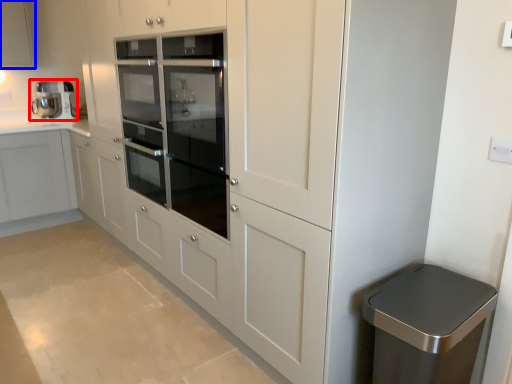
Question: Which object appears closest to the camera in this image, home appliance (highlighted by a red box) or cabinetry (highlighted by a blue box)?

Choices:
 (A) home appliance
 (B) cabinetry

Answer: (B)